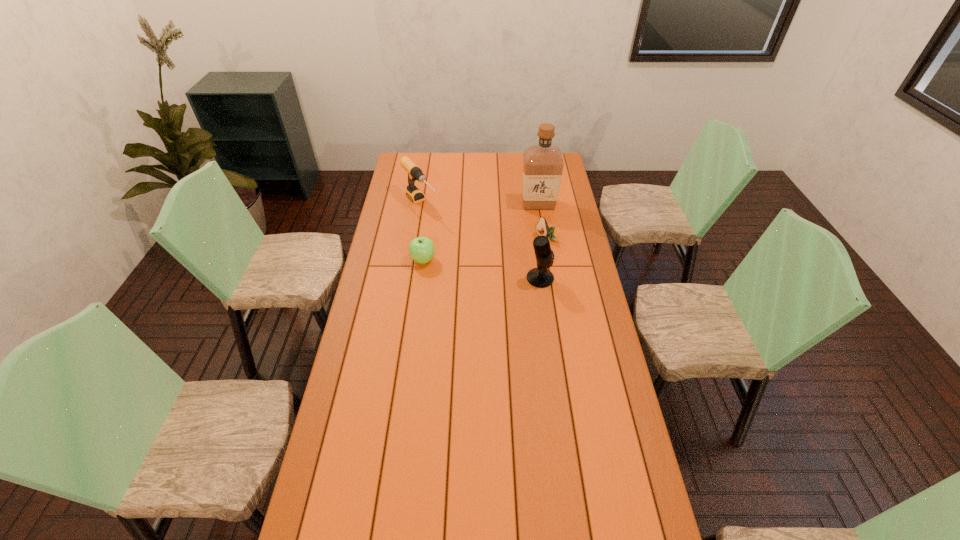
Find the location of a particular element. Image resolution: width=960 pixels, height=540 pixels. vacant space located on the handle side of the drill is located at coordinates (467, 259).

Identify the location of vacant space located on the handle side of the drill. (451, 242).

You are a GUI agent. You are given a task and a screenshot of the screen. Output one action in this format:
    pyautogui.click(x=<x>, y=<y>)
    Task: Click on the vacant space situated 0.350m on the handle side of the drill
    
    Given the screenshot: What is the action you would take?
    pyautogui.click(x=468, y=261)

At what (x,y) coordinates should I click in order to perform the action: click on free space located 0.070m on the seed side of the third nearest object. Please return your answer as a coordinate pair (x, y). This screenshot has width=960, height=540. Looking at the image, I should click on (528, 249).

You are a GUI agent. You are given a task and a screenshot of the screen. Output one action in this format:
    pyautogui.click(x=<x>, y=<y>)
    Task: Click on the free location located on the seed side of the third nearest object
    The image size is (960, 540).
    Given the screenshot: What is the action you would take?
    pyautogui.click(x=492, y=273)

This screenshot has width=960, height=540. I want to click on blank space located on the seed side of the third nearest object, so click(486, 276).

The height and width of the screenshot is (540, 960). Find the location of `apple that is at the left edge`. apple that is at the left edge is located at coordinates (421, 249).

Locate an element on the screen. drill located at the left edge is located at coordinates (415, 173).

What are the coordinates of `microphone that is at the right edge` in the screenshot? It's located at (541, 277).

The height and width of the screenshot is (540, 960). Identify the location of liquor that is at the right edge. click(x=543, y=163).